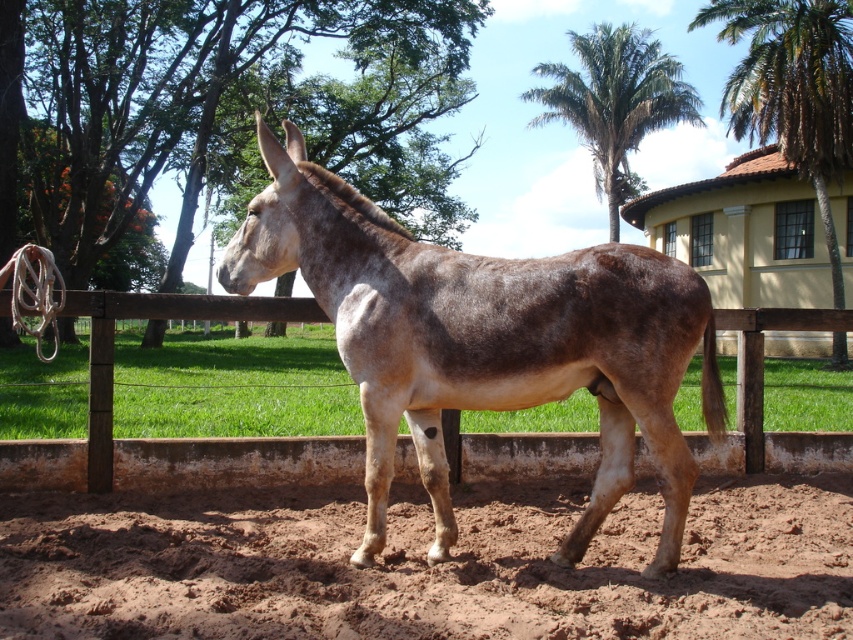
You are a painter setting up your easel to sketch the scene. You want to ensure that both the brown speckled fur at center and the green leafy palm tree at upper right are clearly visible in your composition. Given their sizes, which object should you place closer to the center of your painting to maintain balance?

The brown speckled fur at center is smaller in size compared to the green leafy palm tree at upper right. To maintain balance in the composition, you should place the larger green leafy palm tree at upper right closer to the center of the painting, as its larger size can visually counterbalance the smaller brown speckled fur at center positioned at the center.

You are a gardener who needs to water both the brown sandy soil at lower center and the green leafy palm at upper center. Given that your watering can has a capacity of 10 liters and each watering session can cover an area within a 20 meter radius, can you water both areas without needing to refill your can?

The brown sandy soil at lower center and the green leafy palm at upper center are 36.27 meters apart from each other. Since the watering can can only cover 20 meters, you would need to refill your can to water both areas.

From the picture: You are standing at the point marked by the coordinates point at (x=427, y=566). What type of terrain are you currently standing on?

You are standing on brown sandy soil at lower center.